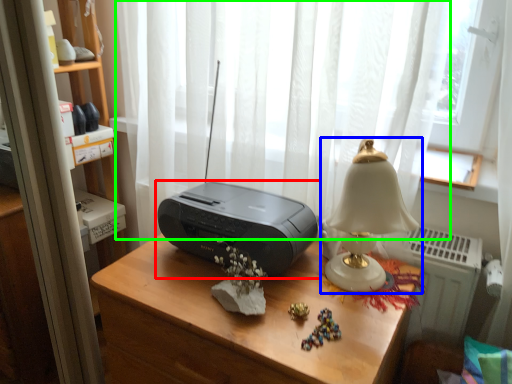
Question: Estimate the real-world distances between objects in this image. Which object is closer to printer (highlighted by a red box), lamp (highlighted by a blue box) or curtain (highlighted by a green box)?

Choices:
 (A) lamp
 (B) curtain

Answer: (A)